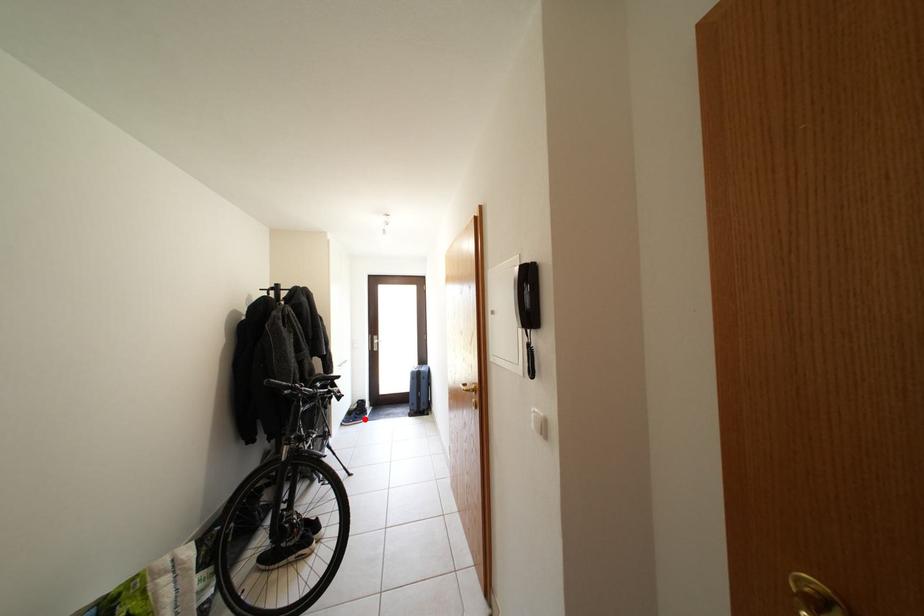
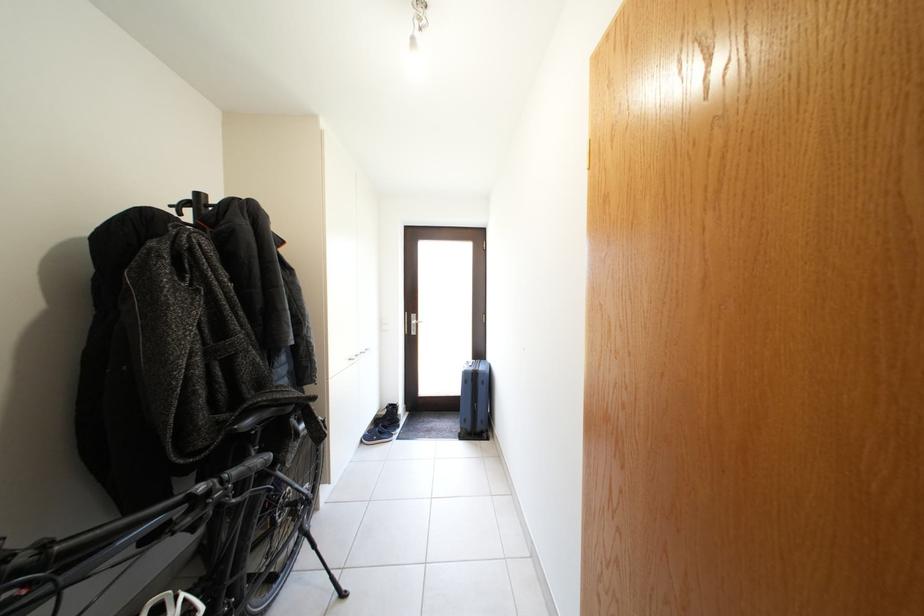
Where in the second image is the point corresponding to the highlighted location from the first image?

(392, 431)